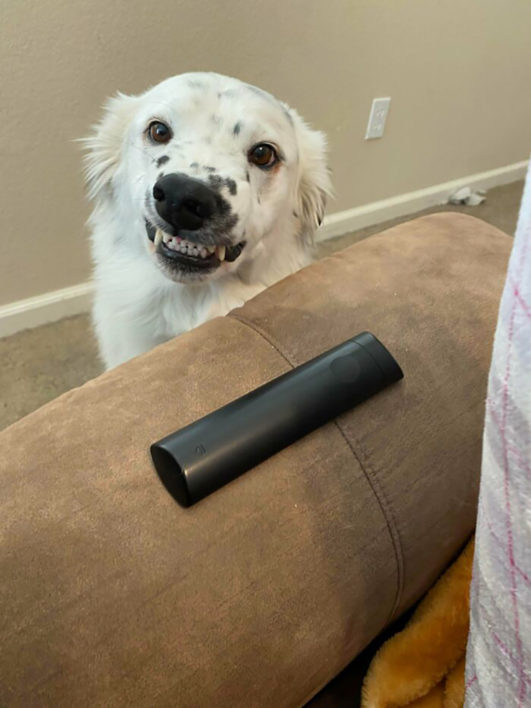
The image size is (531, 708). Find the location of `wall trim`. wall trim is located at coordinates (55, 307).